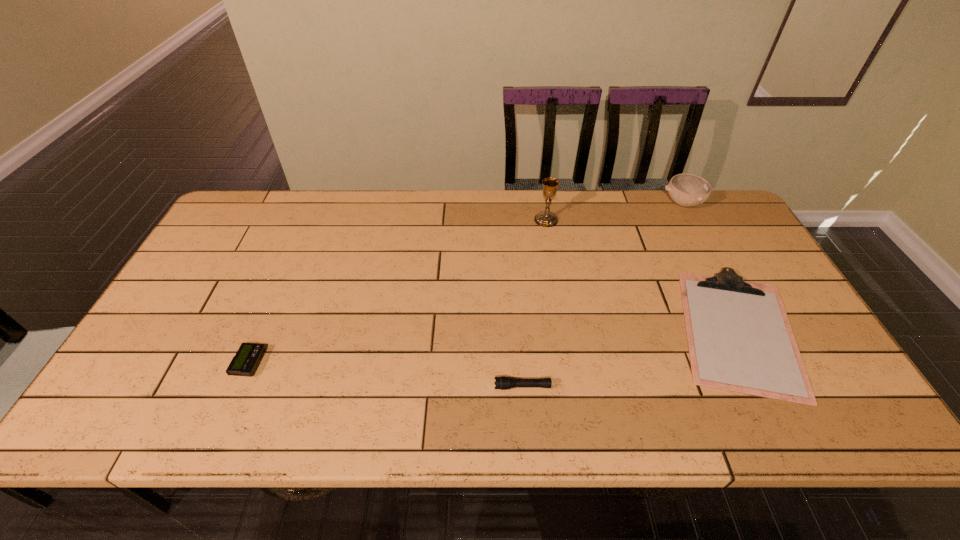
I want to click on vacant space located at the lens end of the flashlight, so click(402, 387).

You are a GUI agent. You are given a task and a screenshot of the screen. Output one action in this format:
    pyautogui.click(x=<x>, y=<y>)
    Task: Click on the vacant space located 0.130m at the lens end of the flashlight
    This screenshot has height=540, width=960.
    Given the screenshot: What is the action you would take?
    pyautogui.click(x=437, y=387)

Locate an element on the screen. The image size is (960, 540). free region located 0.190m on the back of the leftmost object is located at coordinates (280, 290).

Locate an element on the screen. Image resolution: width=960 pixels, height=540 pixels. free space located 0.270m on the back of the clipboard is located at coordinates (680, 214).

Where is `chalice present at the far edge`? The image size is (960, 540). chalice present at the far edge is located at coordinates (546, 218).

At what (x,y) coordinates should I click in order to perform the action: click on bowl at the far edge. Please return your answer as a coordinate pair (x, y). Looking at the image, I should click on (687, 190).

At what (x,y) coordinates should I click in order to perform the action: click on object that is positioned at the near edge. Please return your answer as a coordinate pair (x, y). The image size is (960, 540). Looking at the image, I should click on (739, 337).

At what (x,y) coordinates should I click in order to perform the action: click on bowl that is positioned at the right edge. Please return your answer as a coordinate pair (x, y). The width and height of the screenshot is (960, 540). Looking at the image, I should click on (687, 190).

Locate an element on the screen. The image size is (960, 540). clipboard at the right edge is located at coordinates (739, 337).

I want to click on object present at the far right corner, so click(x=687, y=190).